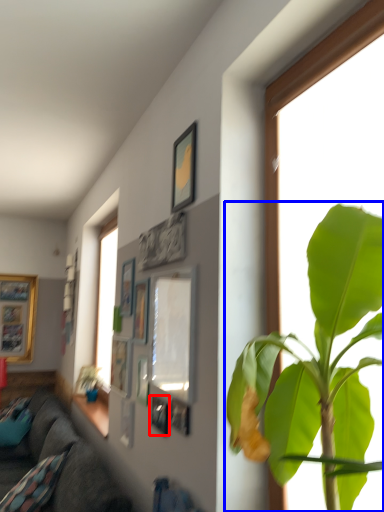
Question: Among these objects, which one is farthest to the camera, picture frame (highlighted by a red box) or houseplant (highlighted by a blue box)?

Choices:
 (A) picture frame
 (B) houseplant

Answer: (A)